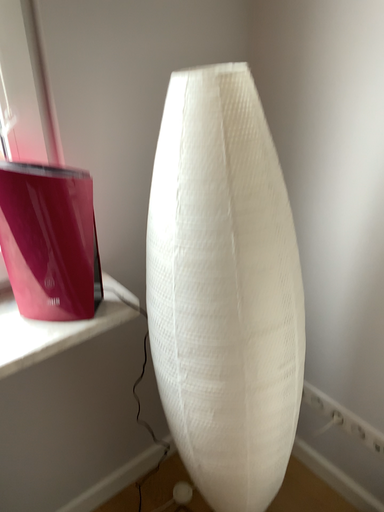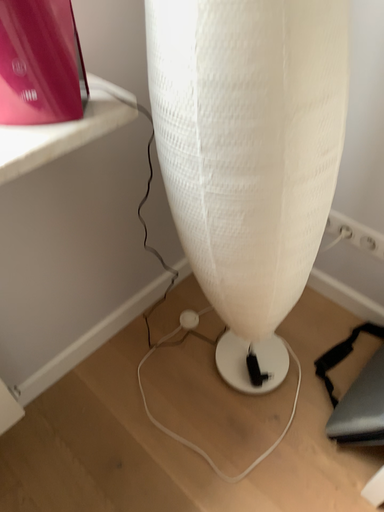
Question: How did the camera likely rotate when shooting the video?

Choices:
 (A) rotated downward
 (B) rotated upward

Answer: (A)